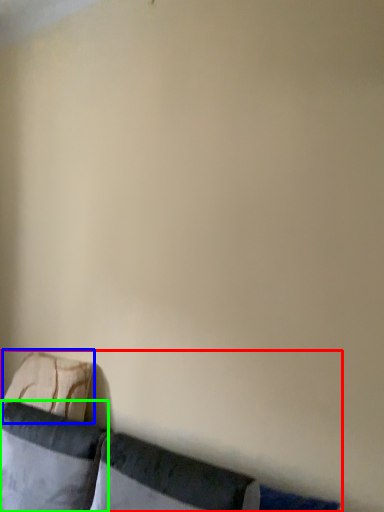
Question: Based on their relative distances, which object is farther from furniture (highlighted by a red box)? Choose from pillow (highlighted by a blue box) and pillow (highlighted by a green box).

Choices:
 (A) pillow
 (B) pillow

Answer: (A)